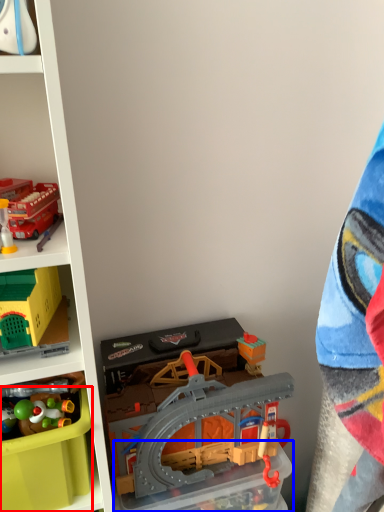
Question: Among these objects, which one is nearest to the camera, storage box (highlighted by a red box) or storage box (highlighted by a blue box)?

Choices:
 (A) storage box
 (B) storage box

Answer: (A)